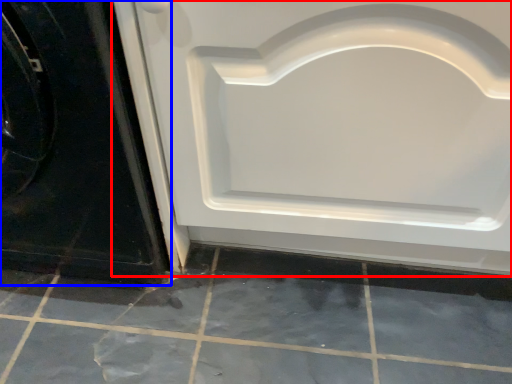
Question: Among these objects, which one is nearest to the camera, door (highlighted by a red box) or door (highlighted by a blue box)?

Choices:
 (A) door
 (B) door

Answer: (A)